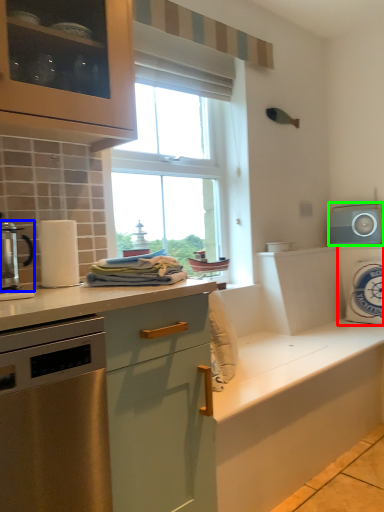
Question: Which is farther away from appliance (highlighted by a red box)? kitchen appliance (highlighted by a blue box) or appliance (highlighted by a green box)?

Choices:
 (A) kitchen appliance
 (B) appliance

Answer: (A)